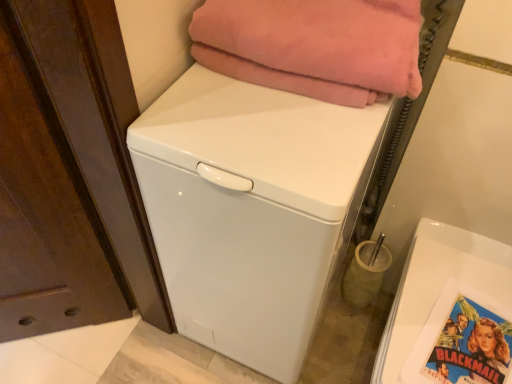
From the picture: What is the approximate width of blue glossy comic book at lower right?

The width of blue glossy comic book at lower right is 8.92 inches.

At what (x,y) coordinates should I click in order to perform the action: click on blue glossy comic book at lower right. Please return your answer as a coordinate pair (x, y). Looking at the image, I should click on (471, 346).

Can you confirm if white glossy washing machine at center is thinner than blue glossy comic book at lower right?

In fact, white glossy washing machine at center might be wider than blue glossy comic book at lower right.

Between white glossy washing machine at center and blue glossy comic book at lower right, which one has less height?

blue glossy comic book at lower right is shorter.

Does white glossy washing machine at center come behind blue glossy comic book at lower right?

No, white glossy washing machine at center is in front of blue glossy comic book at lower right.

This screenshot has height=384, width=512. Identify the location of blanket that is behind the white glossy washing machine at center. (321, 38).

Between white glossy washing machine at center and pink fleece blanket at upper center, which one has larger size?

With larger size is white glossy washing machine at center.

Considering the sizes of objects white glossy washing machine at center and pink fleece blanket at upper center in the image provided, who is taller, white glossy washing machine at center or pink fleece blanket at upper center?

white glossy washing machine at center is taller.

From a real-world perspective, between white glossy washing machine at center and pink fleece blanket at upper center, who is vertically lower?

white glossy washing machine at center is physically lower.

From the image's perspective, is blue glossy comic book at lower right positioned above or below white glossy washing machine at center?

Clearly, from the image's perspective, blue glossy comic book at lower right is below white glossy washing machine at center.

From a real-world perspective, which object stands above the other?

From a 3D spatial view, blue glossy comic book at lower right is above.

Is blue glossy comic book at lower right far from white glossy washing machine at center?

They are positioned close to each other.

Which is correct: blue glossy comic book at lower right is inside pink fleece blanket at upper center, or outside of it?

blue glossy comic book at lower right exists outside the volume of pink fleece blanket at upper center.

Which of these two, blue glossy comic book at lower right or pink fleece blanket at upper center, stands taller?

Standing taller between the two is pink fleece blanket at upper center.

Is blue glossy comic book at lower right smaller than pink fleece blanket at upper center?

Indeed, blue glossy comic book at lower right has a smaller size compared to pink fleece blanket at upper center.

Based on the photo, considering their positions, is blue glossy comic book at lower right located in front of or behind pink fleece blanket at upper center?

Clearly, blue glossy comic book at lower right is behind pink fleece blanket at upper center.

Consider the image. How far apart are pink fleece blanket at upper center and blue glossy comic book at lower right?

pink fleece blanket at upper center and blue glossy comic book at lower right are 25.13 inches apart from each other.

From a real-world perspective, which object rests below the other?

From a 3D spatial view, blue glossy comic book at lower right is below.

Where is `blanket above the blue glossy comic book at lower right (from the image's perspective)`? The height and width of the screenshot is (384, 512). blanket above the blue glossy comic book at lower right (from the image's perspective) is located at coordinates (321, 38).

Between pink fleece blanket at upper center and blue glossy comic book at lower right, which one has smaller width?

blue glossy comic book at lower right is thinner.

Are pink fleece blanket at upper center and white glossy washing machine at center beside each other?

pink fleece blanket at upper center and white glossy washing machine at center are not in contact.

Would you say pink fleece blanket at upper center contains white glossy washing machine at center?

No.

Which is nearer, (374, 17) or (169, 103)?

Point (374, 17).

Relative to white glossy washing machine at center, is pink fleece blanket at upper center in front or behind?

Clearly, pink fleece blanket at upper center is behind white glossy washing machine at center.

Locate an element on the screen. This screenshot has width=512, height=384. comic book above the white glossy washing machine at center (from a real-world perspective) is located at coordinates (471, 346).

Locate an element on the screen. washing machine that appears below the pink fleece blanket at upper center (from the image's perspective) is located at coordinates (248, 209).

Looking at the image, which one is located further to white glossy washing machine at center, blue glossy comic book at lower right or pink fleece blanket at upper center?

blue glossy comic book at lower right lies further to white glossy washing machine at center than the other object.

From the image, which object appears to be farther from pink fleece blanket at upper center, blue glossy comic book at lower right or white glossy washing machine at center?

The object further to pink fleece blanket at upper center is blue glossy comic book at lower right.

Looking at the image, which one is located closer to blue glossy comic book at lower right, white glossy washing machine at center or pink fleece blanket at upper center?

The object closer to blue glossy comic book at lower right is white glossy washing machine at center.

Estimate the real-world distances between objects in this image. Which object is further from white glossy washing machine at center, pink fleece blanket at upper center or blue glossy comic book at lower right?

blue glossy comic book at lower right is further to white glossy washing machine at center.

Looking at the image, which one is located further to pink fleece blanket at upper center, white glossy washing machine at center or blue glossy comic book at lower right?

Among the two, blue glossy comic book at lower right is located further to pink fleece blanket at upper center.

Based on their spatial positions, is pink fleece blanket at upper center or white glossy washing machine at center further from blue glossy comic book at lower right?

Based on the image, pink fleece blanket at upper center appears to be further to blue glossy comic book at lower right.

Locate an element on the screen. washing machine between pink fleece blanket at upper center and blue glossy comic book at lower right vertically is located at coordinates (248, 209).